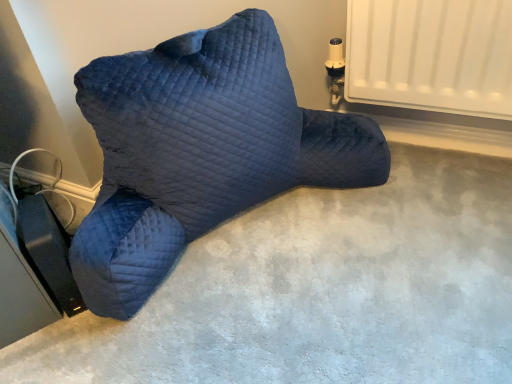
Question: From their relative heights in the image, would you say velvet blue pillow at center is taller or shorter than velvet blue pillow at center?

Choices:
 (A) tall
 (B) short

Answer: (B)

Question: Relative to velvet blue pillow at center, is velvet blue pillow at center in front or behind?

Choices:
 (A) front
 (B) behind

Answer: (A)

Question: Is point (423, 193) positioned closer to the camera than point (144, 215)?

Choices:
 (A) closer
 (B) farther

Answer: (B)

Question: Is velvet blue pillow at center inside or outside of velvet blue pillow at center?

Choices:
 (A) outside
 (B) inside

Answer: (A)

Question: Is velvet blue pillow at center in front of or behind velvet blue pillow at center in the image?

Choices:
 (A) behind
 (B) front

Answer: (A)

Question: Is point (225, 26) positioned closer to the camera than point (288, 301)?

Choices:
 (A) closer
 (B) farther

Answer: (B)

Question: From a real-world perspective, is velvet blue pillow at center above or below velvet blue pillow at center?

Choices:
 (A) above
 (B) below

Answer: (A)